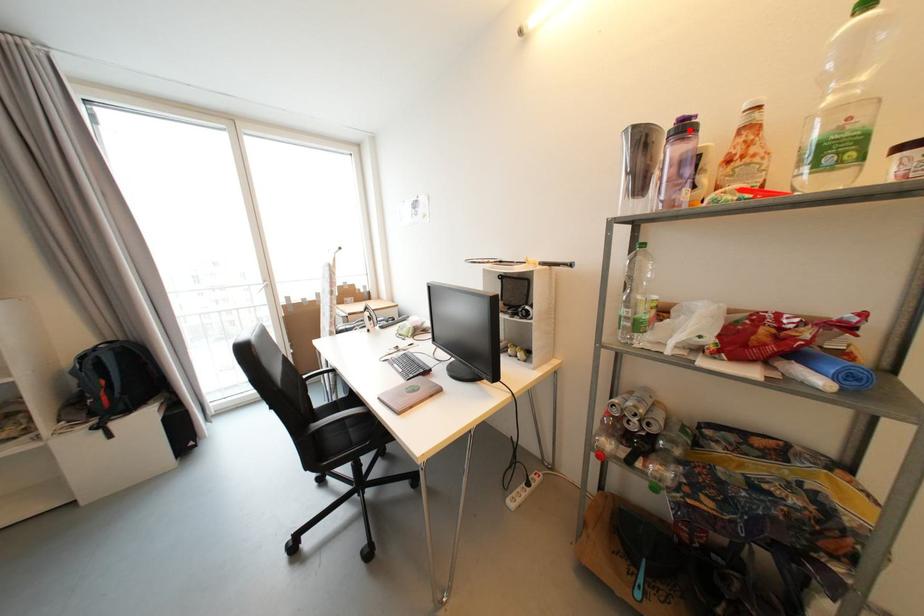
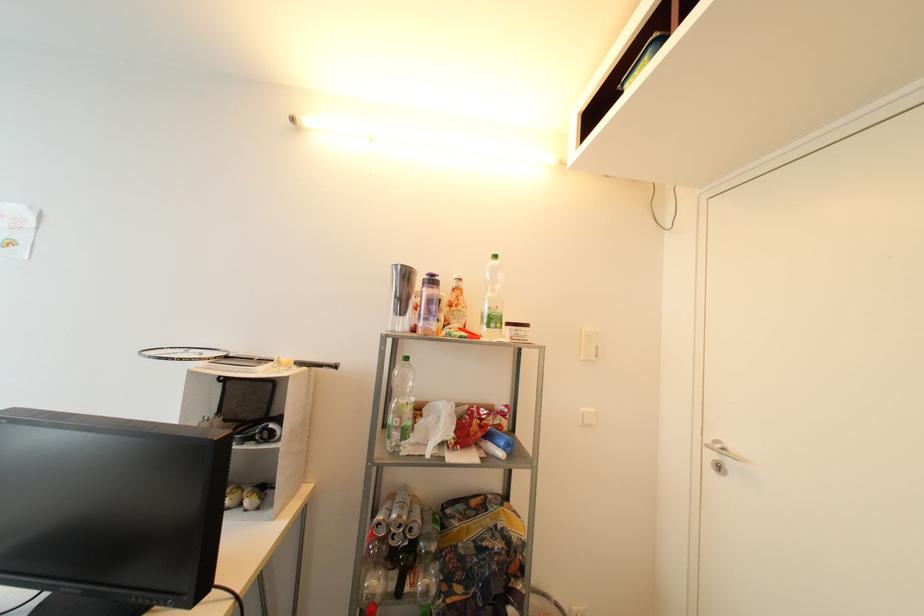
Locate, in the second image, the point that corresponds to the highlighted location in the first image.

(438, 283)